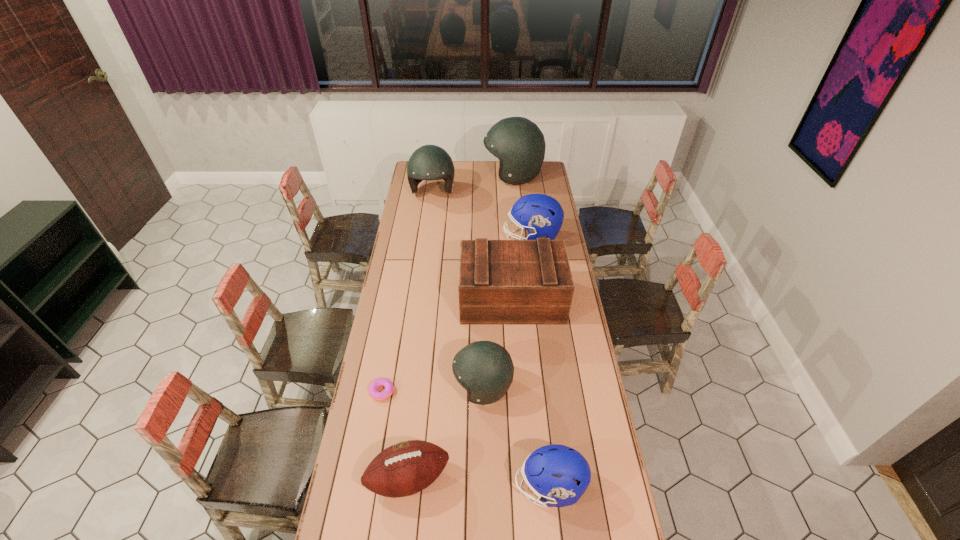
At what (x,y) coordinates should I click in order to perform the action: click on the biggest green football helmet. Please return your answer as a coordinate pair (x, y). The height and width of the screenshot is (540, 960). Looking at the image, I should click on (518, 143).

Locate an element on the screen. This screenshot has height=540, width=960. the tallest object is located at coordinates (518, 143).

You are a GUI agent. You are given a task and a screenshot of the screen. Output one action in this format:
    pyautogui.click(x=<x>, y=<y>)
    Task: Click on the second biggest green football helmet
    
    Given the screenshot: What is the action you would take?
    pyautogui.click(x=429, y=162)

Where is `the leftmost football helmet`? The width and height of the screenshot is (960, 540). the leftmost football helmet is located at coordinates (429, 162).

At what (x,y) coordinates should I click in order to perform the action: click on the third nearest football helmet. Please return your answer as a coordinate pair (x, y). Looking at the image, I should click on (541, 215).

Image resolution: width=960 pixels, height=540 pixels. Identify the location of the bigger blue football helmet. (541, 215).

At what (x,y) coordinates should I click in order to perform the action: click on the fourth farthest object. Please return your answer as a coordinate pair (x, y). Image resolution: width=960 pixels, height=540 pixels. Looking at the image, I should click on (501, 282).

This screenshot has height=540, width=960. In order to click on the fourth farthest football helmet in this screenshot , I will do `click(485, 369)`.

Locate an element on the screen. Image resolution: width=960 pixels, height=540 pixels. the nearest green football helmet is located at coordinates (485, 369).

This screenshot has height=540, width=960. I want to click on the nearest football helmet, so click(x=549, y=471).